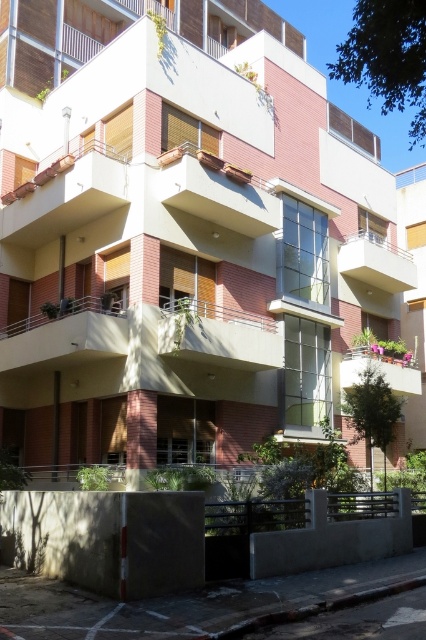
You are standing in front of the modern residential building and notice two balconies. The first is the matte concrete balcony at center, and the second is the white concrete balcony at upper center. Which balcony is positioned to the left when viewed from your perspective?

The matte concrete balcony at center is positioned to the left of the white concrete balcony at upper center.

You are a window cleaner standing on the smooth concrete balcony at center and want to move to the matte concrete balcony at center to clean its windows. In which direction should you move relative to the building?

The smooth concrete balcony at center is positioned on the left side of the matte concrete balcony at center, so you should move to the right to reach it.

You are standing in front of the modern residential building and notice two balconies. Can you determine which balcony is positioned to the left when looking at the smooth concrete balcony at center and the white concrete balcony at upper center?

The smooth concrete balcony at center is positioned to the left of the white concrete balcony at upper center.